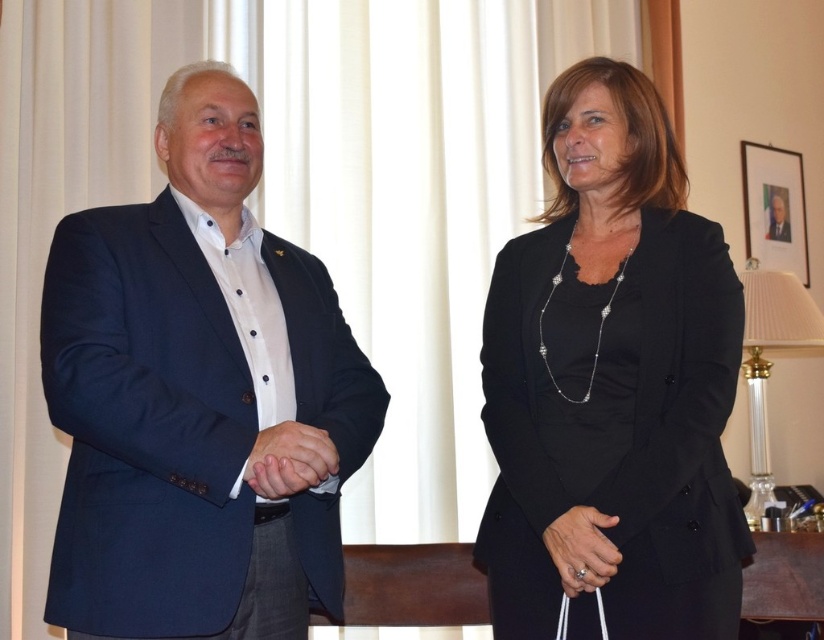
You are an event planner organizing a formal event and need to ensure proper seating arrangements. Given that the matte black suit at left is positioned at coordinates 0.619, 0.238 in the room layout, can you confirm if this location is suitable for the main guest table?

The matte black suit at left is located at point (x=195, y=396), so this position is suitable for the main guest table as it is centrally positioned in the room.

You are a photographer adjusting your camera to capture the scene. You notice the black satin blazer at center and the matte black hand at center. Which object is located to the right of the other?

The black satin blazer at center is positioned on the right side of matte black hand at center.

You are a photographer standing at the camera position. You want to take a closeup shot of the matte black hands at center. The camera has a minimum focusing distance of 5 feet. Can you take the photo without moving the camera or the subject?

The matte black hands at center is 4.96 feet away from camera, so yes, you can take the photo without moving the camera or the subject because the distance is within the camera minimum focusing distance of 5 feet.